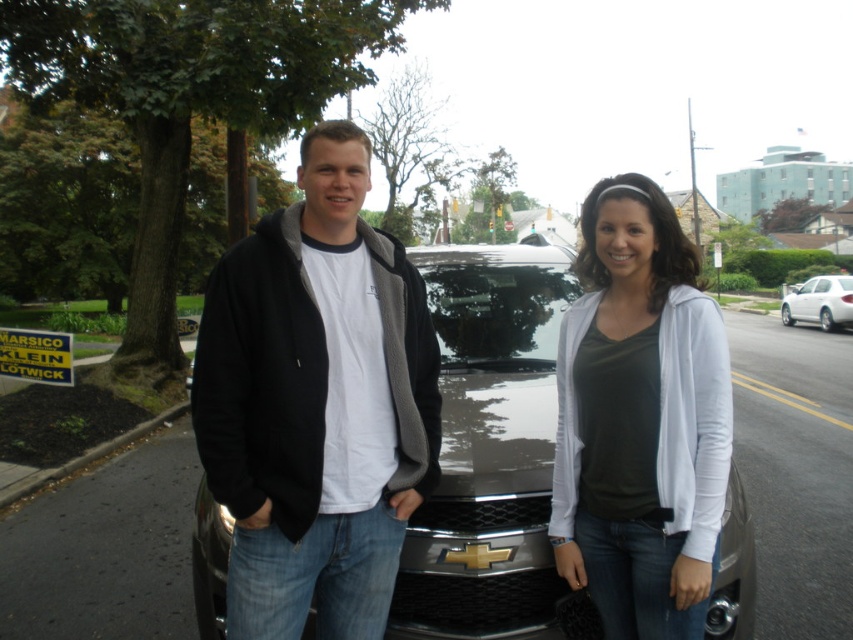
Question: Which object appears farthest from the camera in this image?

Choices:
 (A) black fleece jacket at center
 (B) glossy metallic car at center

Answer: (B)

Question: Which object is the farthest from the glossy metallic car at center?

Choices:
 (A) black fleece jacket at center
 (B) white soft sweater at center

Answer: (B)

Question: Which object is closer to the camera taking this photo?

Choices:
 (A) white soft sweater at center
 (B) glossy metallic car at center

Answer: (A)

Question: Does white soft sweater at center appear over glossy metallic car at center?

Choices:
 (A) no
 (B) yes

Answer: (B)

Question: From the image, what is the correct spatial relationship of black fleece jacket at center in relation to white soft sweater at center?

Choices:
 (A) below
 (B) above

Answer: (A)

Question: Can you confirm if white soft sweater at center is smaller than white glossy sedan at center?

Choices:
 (A) yes
 (B) no

Answer: (A)